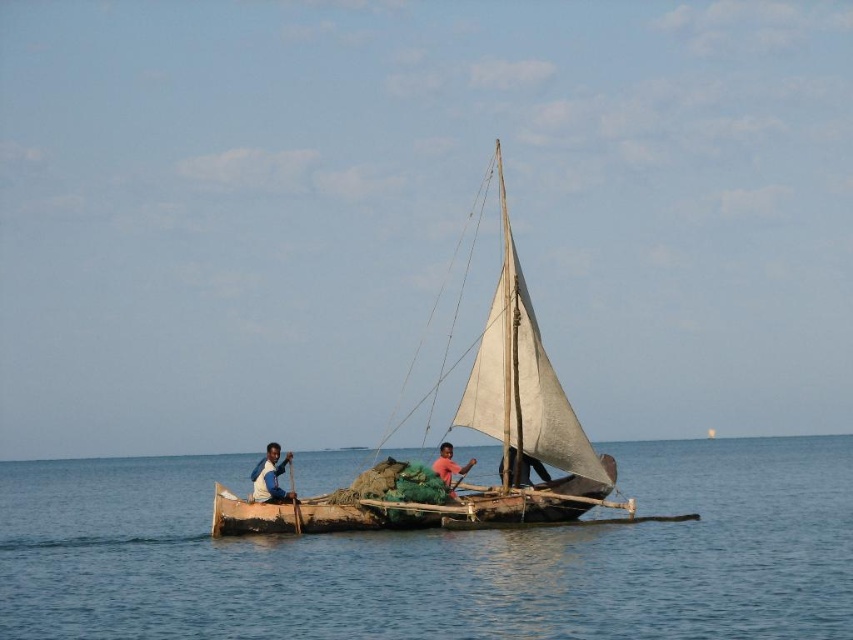
Question: Is blue fabric shirt at center bigger than dark blue fabric sail at center?

Choices:
 (A) no
 (B) yes

Answer: (B)

Question: Among these points, which one is farthest from the camera?

Choices:
 (A) (267, 518)
 (B) (546, 385)
 (C) (442, 472)
 (D) (273, 490)

Answer: (C)

Question: Does white canvas sailboat at center have a lesser width compared to blue fabric shirt at center?

Choices:
 (A) yes
 (B) no

Answer: (B)

Question: Considering the relative positions of blue fabric shirt at center and dark blue fabric sail at center in the image provided, where is blue fabric shirt at center located with respect to dark blue fabric sail at center?

Choices:
 (A) left
 (B) right

Answer: (A)

Question: Which point is closer to the camera?

Choices:
 (A) (444, 449)
 (B) (511, 388)
 (C) (502, 472)

Answer: (B)

Question: Which object is farther from the camera taking this photo?

Choices:
 (A) dark blue fabric sail at center
 (B) clear blue water at center
 (C) blue fabric shirt at center
 (D) dark skin human at center

Answer: (A)